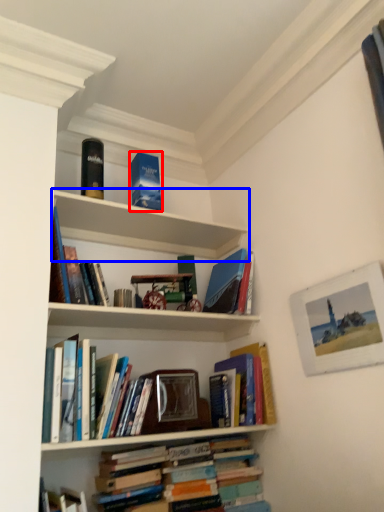
Question: Among these objects, which one is farthest to the camera, paperback book (highlighted by a red box) or shelf (highlighted by a blue box)?

Choices:
 (A) paperback book
 (B) shelf

Answer: (A)